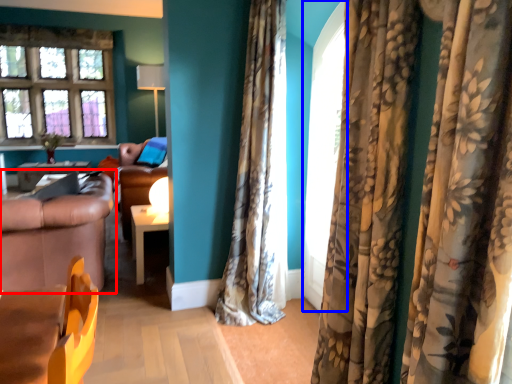
Question: Which object is closer to the camera taking this photo, studio couch (highlighted by a red box) or screen door (highlighted by a blue box)?

Choices:
 (A) studio couch
 (B) screen door

Answer: (B)